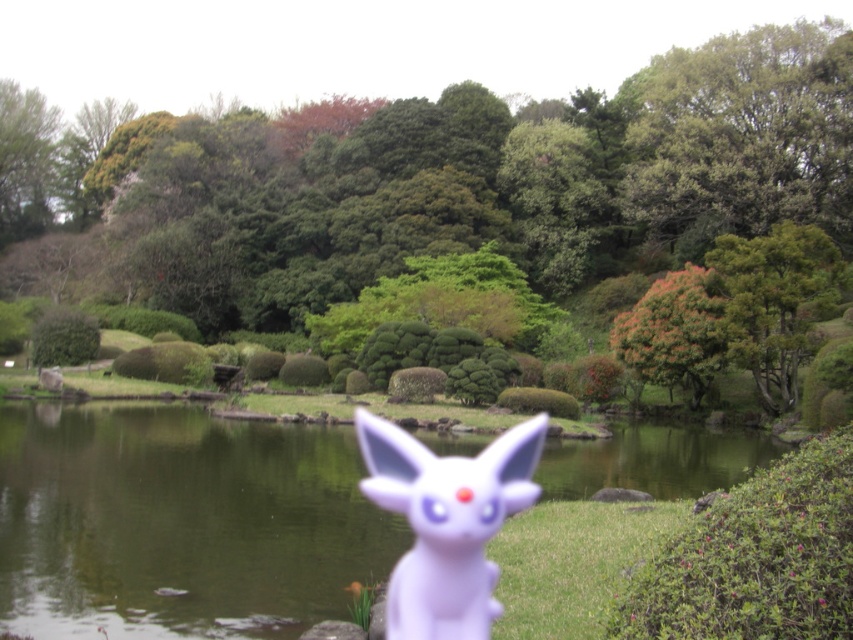
Question: Based on their relative distances, which object is farther from the green leafy tree at upper right?

Choices:
 (A) green leafy tree at upper center
 (B) orange-brown textured tree at center-right

Answer: (B)

Question: Which point appears closest to the camera in this image?

Choices:
 (A) (621, 211)
 (B) (474, 476)

Answer: (B)

Question: Does purple matte rabbit at center come in front of orange-brown textured tree at center-right?

Choices:
 (A) yes
 (B) no

Answer: (A)

Question: Which object is farther from the camera taking this photo?

Choices:
 (A) purple matte rabbit at center
 (B) green leafy tree at upper center
 (C) transparent plastic water at center

Answer: (B)

Question: Can you confirm if green leafy tree at upper center is positioned to the left of purple matte rabbit at center?

Choices:
 (A) no
 (B) yes

Answer: (B)

Question: Can you confirm if green leafy tree at upper right is bigger than purple matte rabbit at center?

Choices:
 (A) no
 (B) yes

Answer: (B)